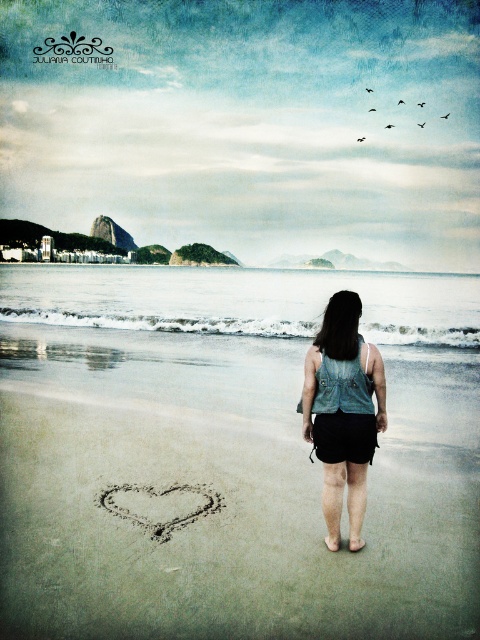
Question: Among these objects, which one is farthest from the camera?

Choices:
 (A) brown sand heart at lower center
 (B) smooth sand heart at center
 (C) denim vest at center

Answer: (A)

Question: Does smooth sand heart at center have a lesser width compared to denim vest at center?

Choices:
 (A) yes
 (B) no

Answer: (B)

Question: Which object is farther from the camera taking this photo?

Choices:
 (A) brown sand heart at lower center
 (B) smooth sand heart at center

Answer: (A)

Question: Is denim vest at center closer to the viewer compared to brown sand heart at lower center?

Choices:
 (A) no
 (B) yes

Answer: (B)

Question: Can you confirm if smooth sand heart at center is positioned to the right of denim vest at center?

Choices:
 (A) yes
 (B) no

Answer: (B)

Question: Which point is farther to the camera?

Choices:
 (A) (146, 516)
 (B) (248, 545)

Answer: (A)